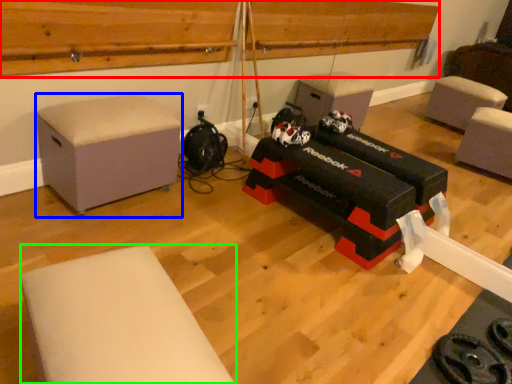
Question: Which object is the closest to the wood (highlighted by a red box)? Choose among these: furniture (highlighted by a blue box) or furniture (highlighted by a green box).

Choices:
 (A) furniture
 (B) furniture

Answer: (A)